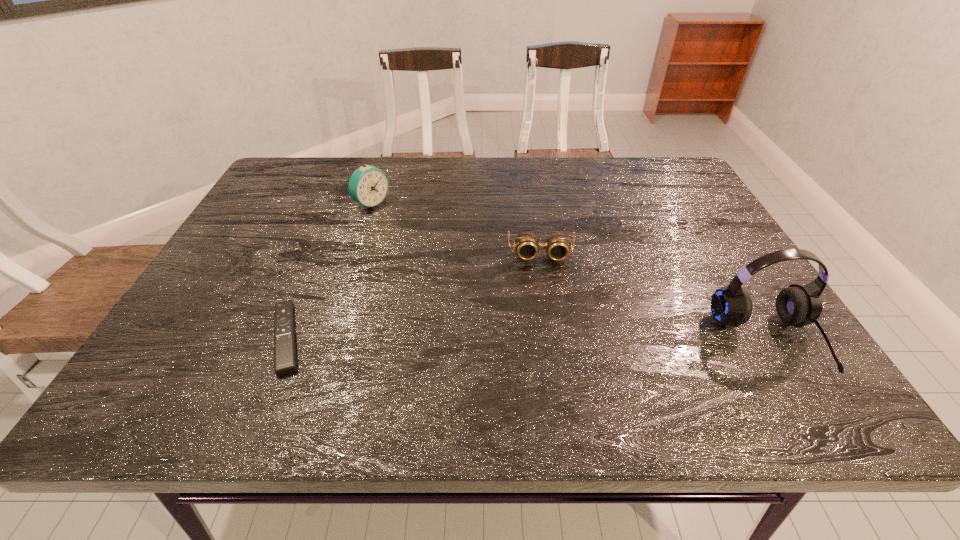
The width and height of the screenshot is (960, 540). Identify the location of the shortest object. (285, 362).

The image size is (960, 540). I want to click on headset, so click(796, 305).

I want to click on the rightmost object, so click(796, 305).

Image resolution: width=960 pixels, height=540 pixels. Find the location of `the farthest object`. the farthest object is located at coordinates (368, 185).

Find the location of `the second tallest object`. the second tallest object is located at coordinates [368, 185].

Locate an element on the screen. The height and width of the screenshot is (540, 960). goggles is located at coordinates (527, 244).

Locate an element on the screen. The height and width of the screenshot is (540, 960). the third nearest object is located at coordinates (527, 244).

At what (x,y) coordinates should I click in order to perform the action: click on free space located on the back of the shortest object. Please return your answer as a coordinate pair (x, y). Image resolution: width=960 pixels, height=540 pixels. Looking at the image, I should click on (327, 237).

Find the location of a particular element. The width and height of the screenshot is (960, 540). vacant space located on the front-facing side of the alarm clock is located at coordinates [416, 232].

Locate an element on the screen. vacant space located on the front-facing side of the alarm clock is located at coordinates (475, 271).